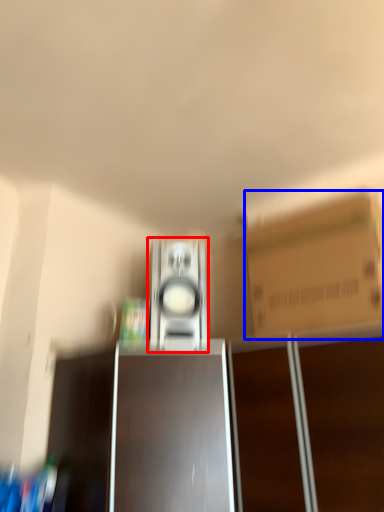
Question: Which object is further to the camera taking this photo, home appliance (highlighted by a red box) or cardboard box (highlighted by a blue box)?

Choices:
 (A) home appliance
 (B) cardboard box

Answer: (A)